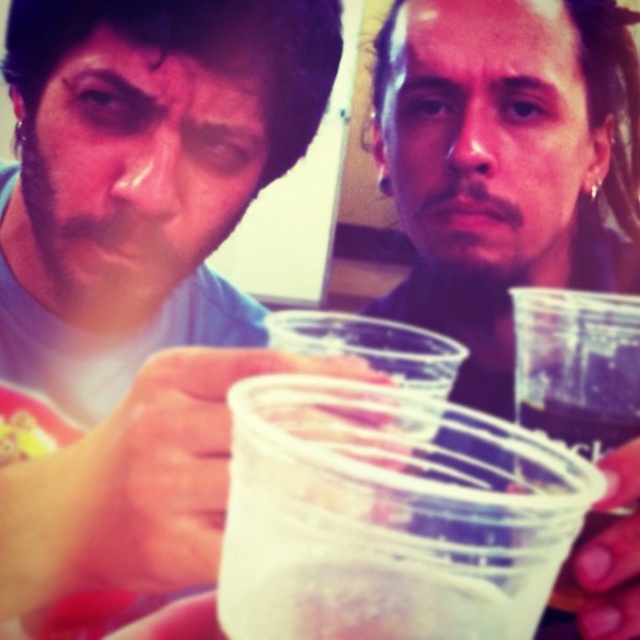
How distant is matte plastic cup at center from clear plastic cup at center?

The distance of matte plastic cup at center from clear plastic cup at center is 9.34 inches.

Is matte plastic cup at center to the left of clear plastic cup at center from the viewer's perspective?

Correct, you'll find matte plastic cup at center to the left of clear plastic cup at center.

Is point (72, 296) behind point (604, 419)?

Yes, it is behind point (604, 419).

What are the coordinates of `matte plastic cup at center` in the screenshot? It's located at (147, 189).

Is point (624, 609) closer to viewer compared to point (33, 440)?

Yes, it is.

Which of these two, transparent plastic cup at center or yellow matte food at lower left, stands shorter?

yellow matte food at lower left

Locate an element on the screen. The height and width of the screenshot is (640, 640). transparent plastic cup at center is located at coordinates (504, 163).

Does clear plastic cup at center have a smaller size compared to yellow matte food at lower left?

Incorrect, clear plastic cup at center is not smaller in size than yellow matte food at lower left.

Which is in front, point (563, 573) or point (3, 419)?

Positioned in front is point (563, 573).

Find the location of a particular element. The image size is (640, 640). clear plastic cup at center is located at coordinates (579, 426).